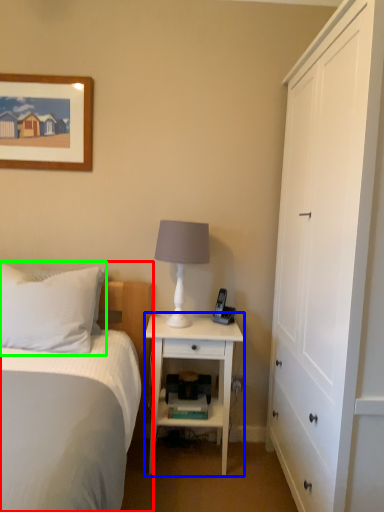
Question: Which is nearer to the bed (highlighted by a red box)? nightstand (highlighted by a blue box) or pillow (highlighted by a green box).

Choices:
 (A) nightstand
 (B) pillow

Answer: (B)